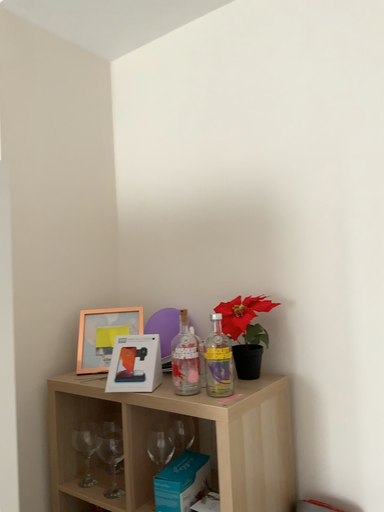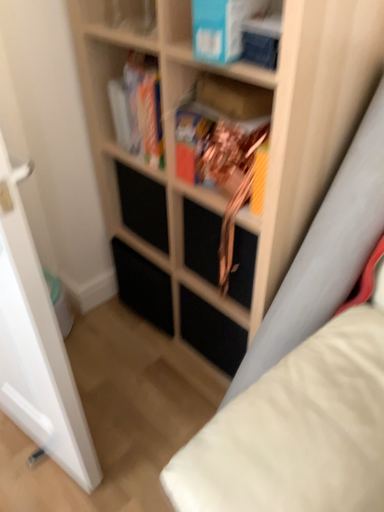
Question: How did the camera likely rotate when shooting the video?

Choices:
 (A) rotated downward
 (B) rotated upward

Answer: (A)